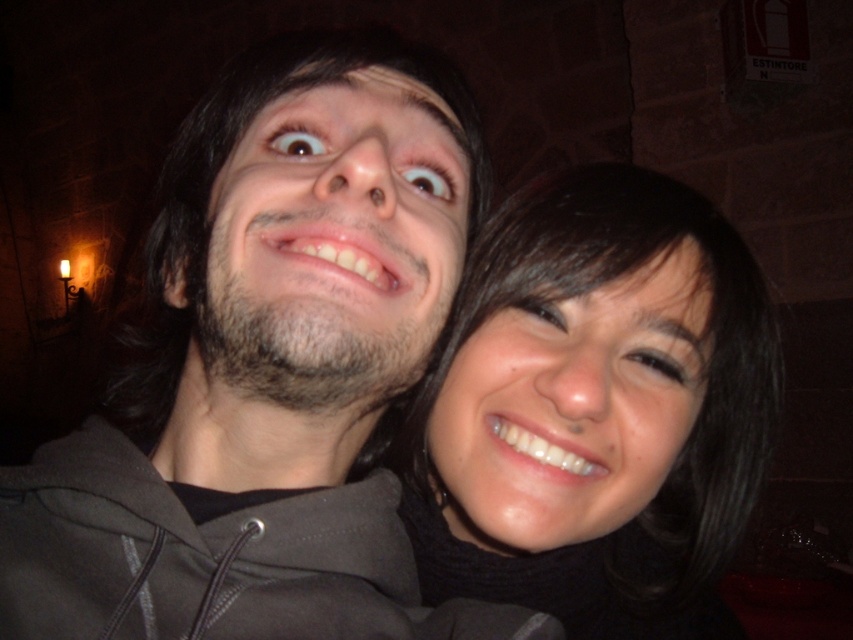
You are a photographer trying to capture a closeup shot of both the matte black hoodie at center and the smooth black hair at center. Since the camera can only focus on objects within 5 inches of each other, will you be able to get a clear photo of both?

The matte black hoodie at center is 5.81 inches from the smooth black hair at center. Since the distance between them is greater than 5 inches, the camera cannot focus on both objects simultaneously, so you won

You are a photographer adjusting the lighting for a photo shoot. You have a spotlight that can only illuminate a circular area with a radius of 0.1 units. The center of the spotlight must be placed exactly at point (x=270, y=369). Will the spotlight fully cover the matte black hoodie at center?

The point (x=270, y=369) marks the matte black hoodie at center. Since the spotlight is centered at this point with a radius of 0.1 units, it will fully cover the matte black hoodie at center as long as its dimensions are within the spotlight radius.

You are a photographer trying to capture a clear photo of the two people in the scene. Since the matte black hoodie at center and the smooth black hair at center are both at the center, which one will be easier to focus on, and why?

The matte black hoodie at center will be easier to focus on because its width is larger than the smooth black hair at center, making it a more distinct target for the camera.